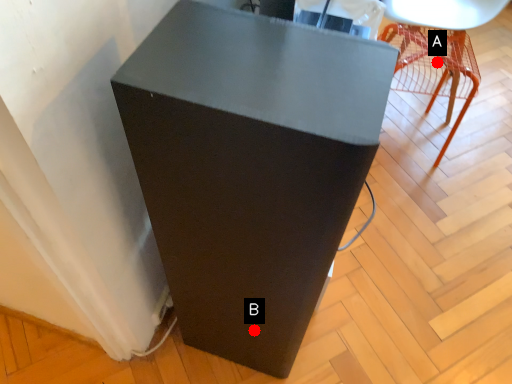
Question: Two points are circled on the image, labeled by A and B beside each circle. Which point is farther from the camera taking this photo?

Choices:
 (A) A is further
 (B) B is further

Answer: (A)